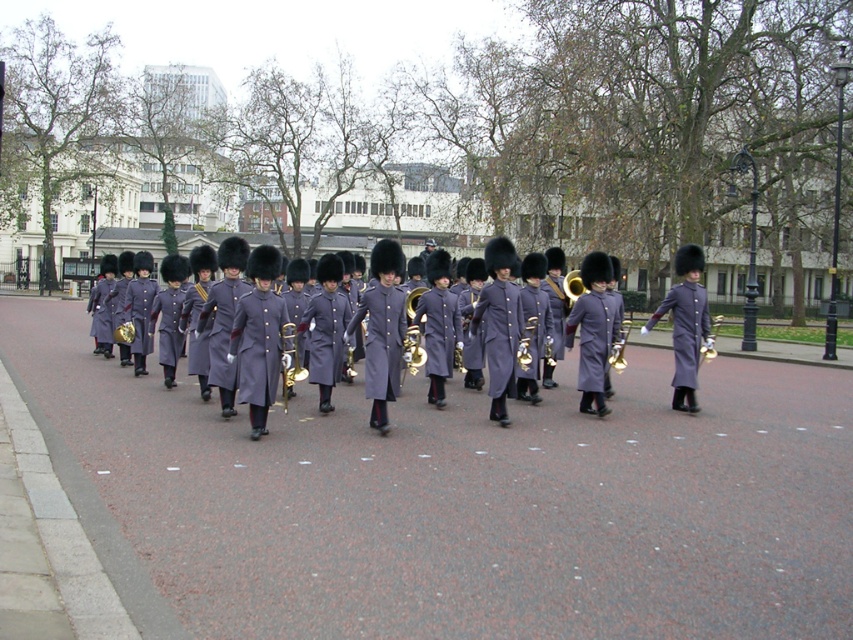
Question: Estimate the real-world distances between objects in this image. Which object is closer to the gold brass instrument at center?

Choices:
 (A) brass polished tuba at center
 (B) brass polished trumpet at center
 (C) matte purple coat at center

Answer: (A)

Question: Does matte purple uniform at center have a larger size compared to matte purple coat at center?

Choices:
 (A) yes
 (B) no

Answer: (A)

Question: Considering the real-world distances, which object is farthest from the brass polished tuba at center?

Choices:
 (A) brass polished trumpet at center
 (B) shiny brass trumpet at center
 (C) matte purple coat at center
 (D) gold brass bell at center

Answer: (D)

Question: Is gold brass trombone at center bigger than shiny brass trumpet at center?

Choices:
 (A) yes
 (B) no

Answer: (B)

Question: Can you confirm if matte purple uniform at center is thinner than brass polished trumpet at center?

Choices:
 (A) yes
 (B) no

Answer: (B)

Question: Which point is farther to the camera?

Choices:
 (A) gold brass trombone at center
 (B) gold brass instrument at center
 (C) gold brass bell at center
 (D) shiny brass trumpet at center

Answer: (B)